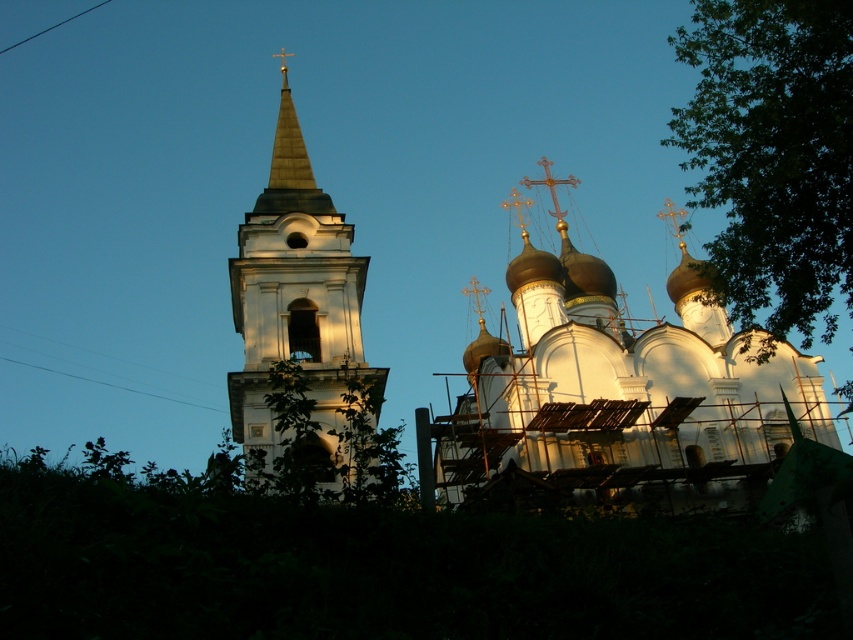
Question: Can you confirm if white textured dome at center is positioned to the left of white stone bell tower at center?

Choices:
 (A) yes
 (B) no

Answer: (B)

Question: Which point is closer to the camera taking this photo?

Choices:
 (A) (833, 128)
 (B) (424, 465)

Answer: (B)

Question: Where is white textured dome at center located in relation to white stone bell tower at center in the image?

Choices:
 (A) below
 (B) above

Answer: (A)

Question: Does white textured dome at center have a larger size compared to white stone bell tower at center?

Choices:
 (A) no
 (B) yes

Answer: (B)

Question: Which of the following is the closest to the observer?

Choices:
 (A) white textured dome at center
 (B) white stone bell tower at center
 (C) green leafy tree at upper right

Answer: (B)

Question: Estimate the real-world distances between objects in this image. Which object is farther from the white stone bell tower at center?

Choices:
 (A) white textured dome at center
 (B) green leafy tree at upper right

Answer: (B)